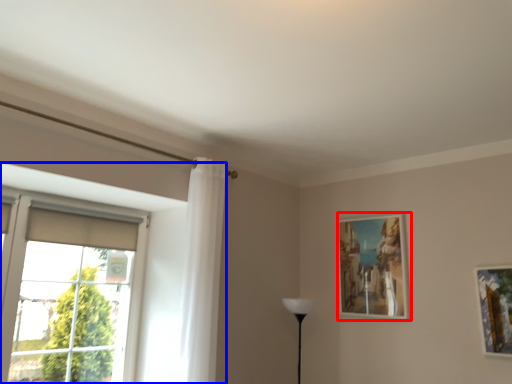
Question: Which object appears farthest to the camera in this image, picture frame (highlighted by a red box) or window (highlighted by a blue box)?

Choices:
 (A) picture frame
 (B) window

Answer: (A)